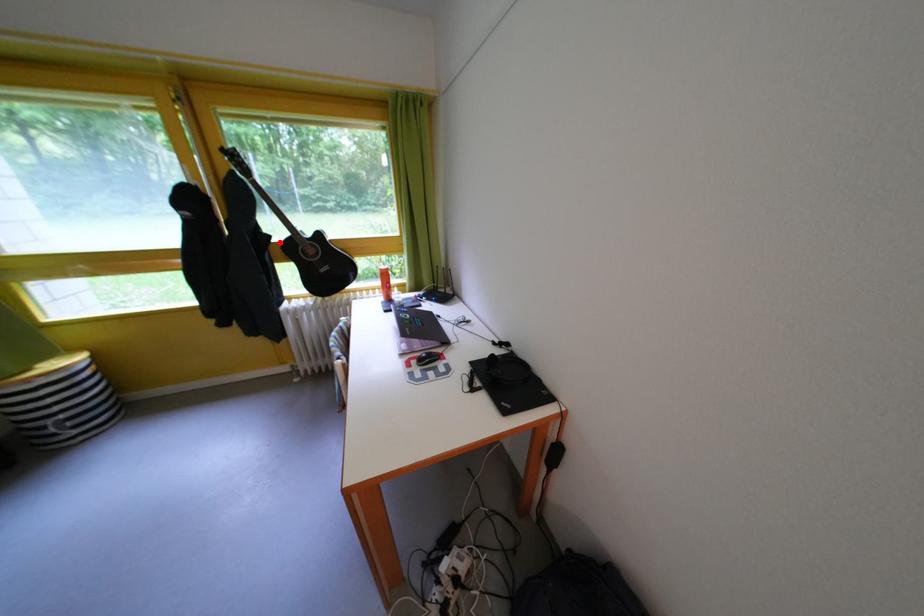
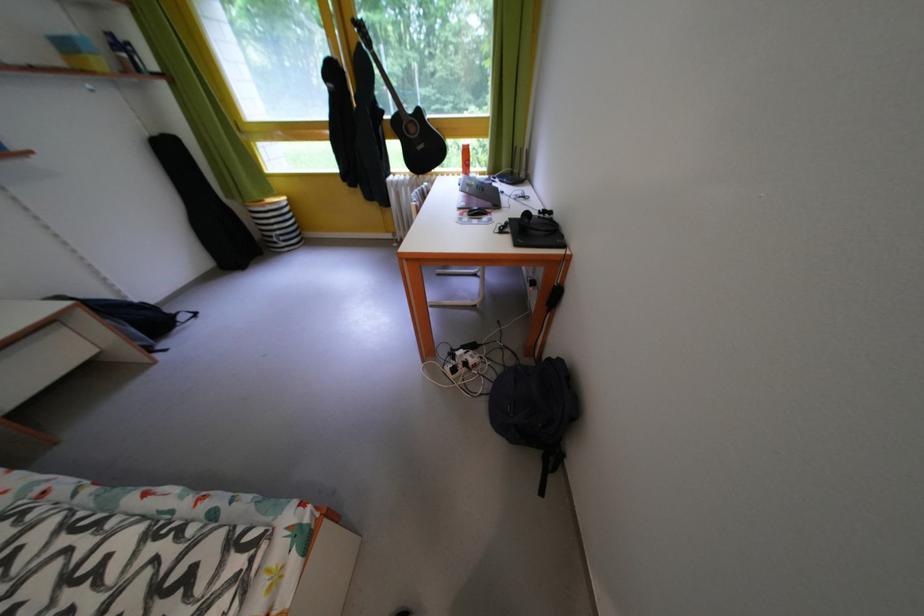
Question: I am providing you with two images of the same scene from different viewpoints. A red point is shown in image1. For the corresponding object point in image2, is it positioned nearer or farther from the camera?

Choices:
 (A) Nearer
 (B) Farther

Answer: (A)